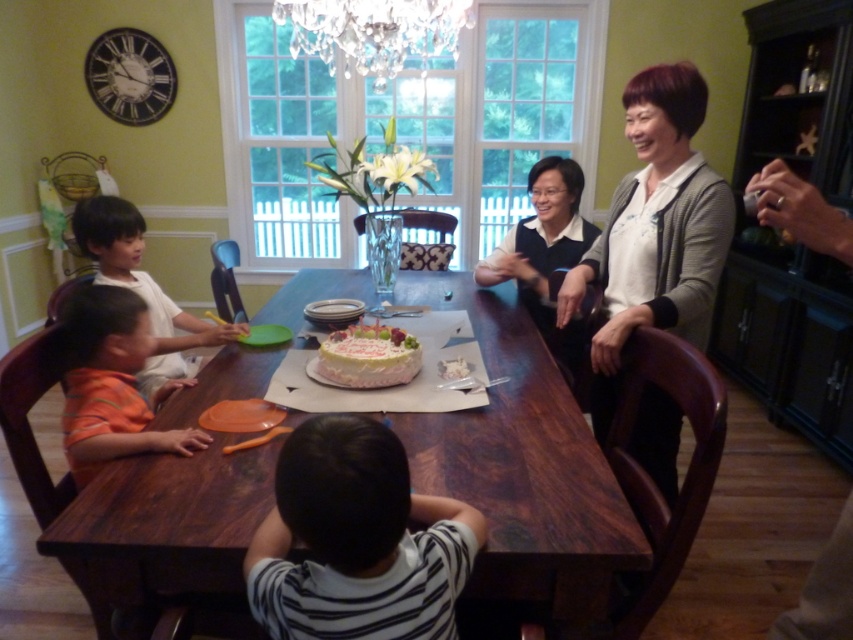
You are a guest at this family gathering and need to sit down. You see the wooden table at center and the striped fabric shirt at lower center. Which object is closer to you?

The striped fabric shirt at lower center is behind the wooden table at center, so the wooden table at center is closer to you.

You are a guest at this family gathering and need to place your white knit sweater at upper right on the wooden table at center. Can you do so without moving any other items on the table?

The wooden table at center is in front of the white knit sweater at upper right, so you can place your white knit sweater at upper right on the wooden table at center without moving other items as there is no obstruction between them.

You are a photographer standing at the camera position in the scene. You want to take a photo of the wooden table at center. Can you reach the table to adjust its position without moving your feet? Assume your arm can extend 0.8 meters.

The wooden table at center and camera are 1.09 meters apart, and your arm can extend 0.8 meters. Since 0.8 meters is less than 1.09 meters, you cannot reach the table to adjust its position without moving your feet.